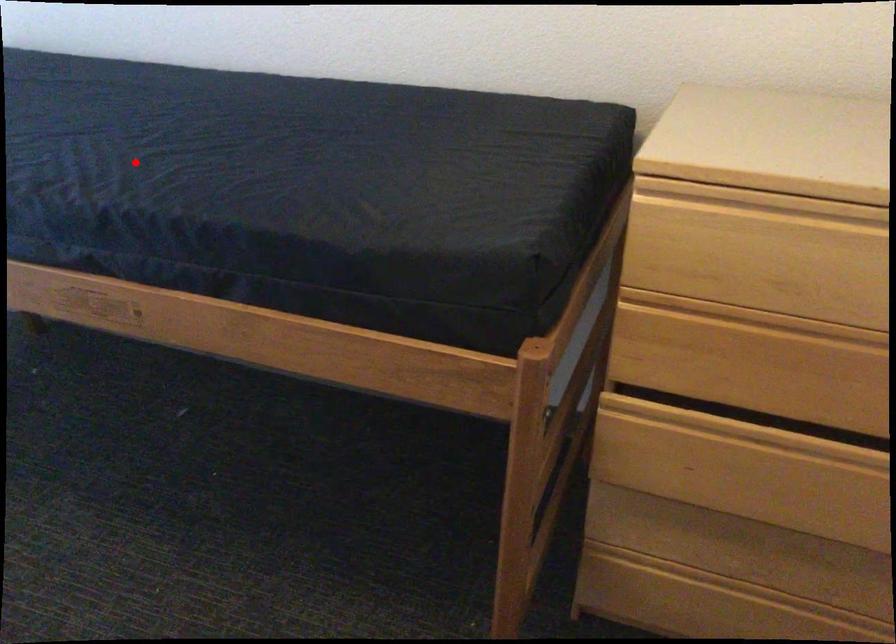
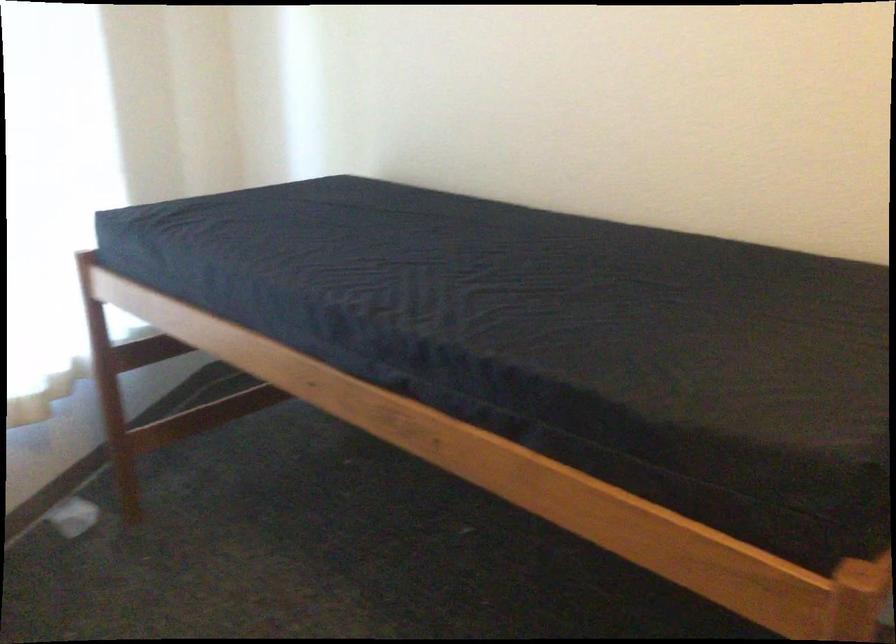
The point at the highlighted location is marked in the first image. Where is the corresponding point in the second image?

(460, 297)